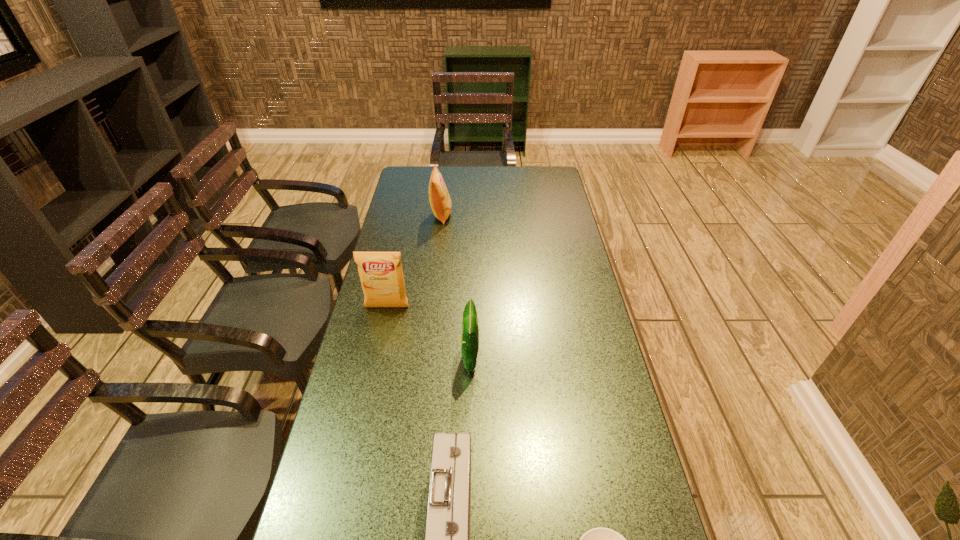
Locate which crisp (potato chip) ranks third in proximity to the first-aid kit. Please provide its 2D coordinates. Your answer should be formatted as a tuple, i.e. [(x, y)], where the tuple contains the x and y coordinates of a point satisfying the conditions above.

[(439, 198)]

This screenshot has width=960, height=540. What are the coordinates of `crisp (potato chip) that is the second closest to the second farthest object` in the screenshot? It's located at (439, 198).